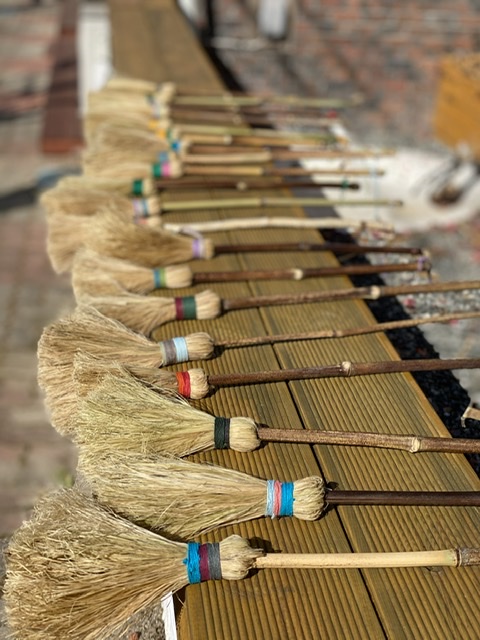
Find the location of a particular element. table is located at coordinates (329, 600).